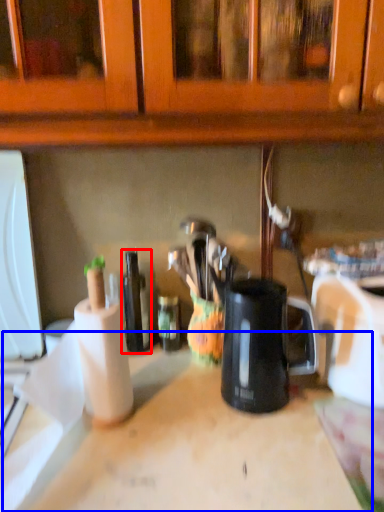
Question: Which object is further to the camera taking this photo, bottle (highlighted by a red box) or counter top (highlighted by a blue box)?

Choices:
 (A) bottle
 (B) counter top

Answer: (A)